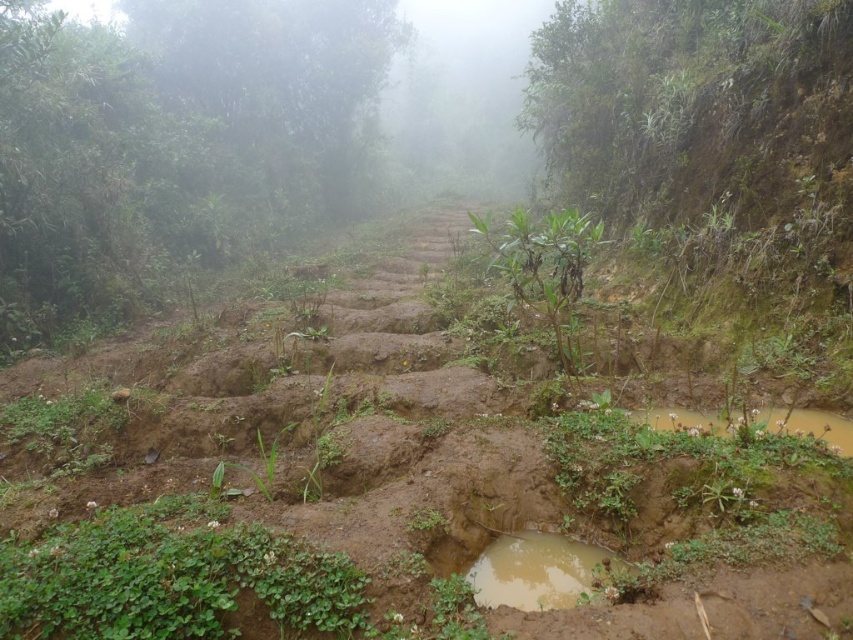
You are a hiker walking along the path and notice the green leafy plants at upper left and the muddy wet puddle at lower center. Which object is located to the left of the other?

The green leafy plants at upper left is positioned on the left side of muddy wet puddle at lower center.

You are standing on the rugged path in the misty forest and see two points marked on the ground. The first point is at coordinate point (67,269) and the second is at point (524,561). Which point is closer to you?

Point (67,269) is further to the camera than point (524,561), so the point closer to you is point (524,561).

You are a hiker who wants to avoid getting your shoes dirty. The brown muddy steps at center and the muddy wet puddle at lower center are both on your path. Which one should you step on to keep your shoes cleaner?

The brown muddy steps at center has a larger size compared to muddy wet puddle at lower center, so stepping on the larger brown muddy steps at center would provide a more stable and less muddy surface, keeping your shoes cleaner.